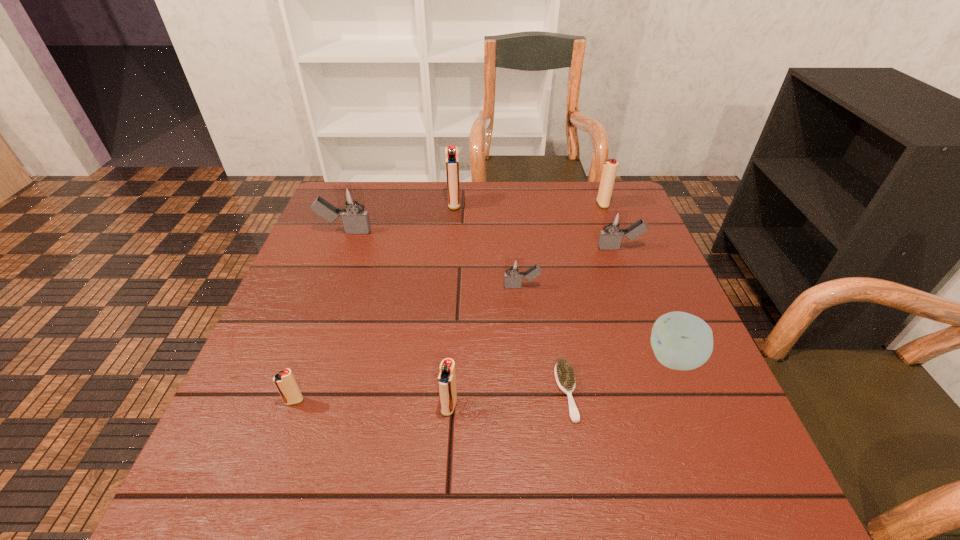
At what (x,y) coordinates should I click in order to perform the action: click on the tallest igniter. Please return your answer as a coordinate pair (x, y). The width and height of the screenshot is (960, 540). Looking at the image, I should click on (451, 152).

Identify the location of the tallest object. (451, 152).

Locate an element on the screen. The height and width of the screenshot is (540, 960). the rightmost red igniter is located at coordinates (609, 170).

Find the location of a particular element. This screenshot has height=540, width=960. the seventh nearest object is located at coordinates (355, 220).

Where is `the biggest gray igniter`? The width and height of the screenshot is (960, 540). the biggest gray igniter is located at coordinates (355, 220).

At what (x,y) coordinates should I click in order to perform the action: click on the second farthest gray igniter. Please return your answer as a coordinate pair (x, y). The image size is (960, 540). Looking at the image, I should click on (614, 223).

Identify the location of the second smallest gray igniter. (614, 223).

The height and width of the screenshot is (540, 960). I want to click on the second smallest red igniter, so click(447, 379).

Locate an element on the screen. The image size is (960, 540). apple is located at coordinates (681, 341).

I want to click on the smallest red igniter, so click(x=285, y=382).